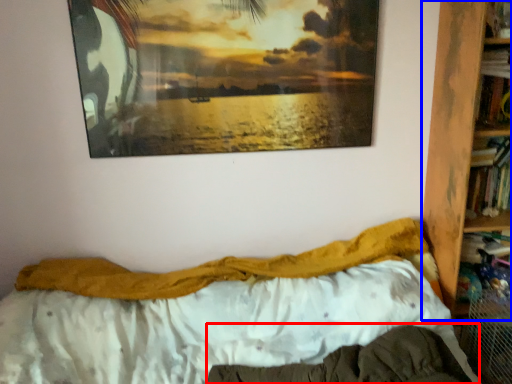
Question: Which point is further to the camera, mattress (highlighted by a red box) or bookcase (highlighted by a blue box)?

Choices:
 (A) mattress
 (B) bookcase

Answer: (B)